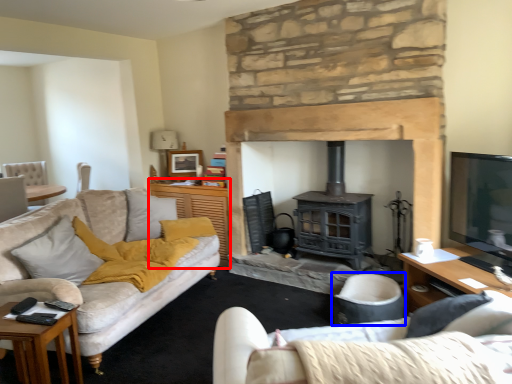
Question: Which point is closer to the camera, table (highlighted by a red box) or armchair (highlighted by a blue box)?

Choices:
 (A) table
 (B) armchair

Answer: (B)